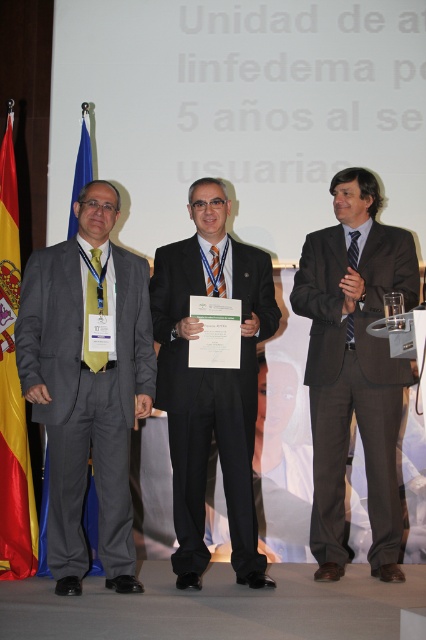
Which is above, matte gray suit at left or brown wool suit at center?

brown wool suit at center

Is point (86, 419) positioned in front of point (380, 490)?

That is True.

Which is in front, point (95, 376) or point (374, 484)?

Point (95, 376)

What are the coordinates of `matte gray suit at left` in the screenshot? It's located at (88, 385).

The width and height of the screenshot is (426, 640). What do you see at coordinates (354, 369) in the screenshot?
I see `brown wool suit at center` at bounding box center [354, 369].

Does brown wool suit at center appear on the left side of red fabric flag at left?

In fact, brown wool suit at center is to the right of red fabric flag at left.

Image resolution: width=426 pixels, height=640 pixels. I want to click on brown wool suit at center, so click(354, 369).

Does matte gray suit at left have a lesser height compared to black suit at center?

Yes, matte gray suit at left is shorter than black suit at center.

In the scene shown: Measure the distance between matte gray suit at left and camera.

matte gray suit at left and camera are 10.55 feet apart.

Who is more forward, [58,378] or [232,460]?

Positioned in front is point [58,378].

You are a GUI agent. You are given a task and a screenshot of the screen. Output one action in this format:
    pyautogui.click(x=<x>, y=<y>)
    Task: Click on the matte gray suit at left
    
    Given the screenshot: What is the action you would take?
    pyautogui.click(x=88, y=385)